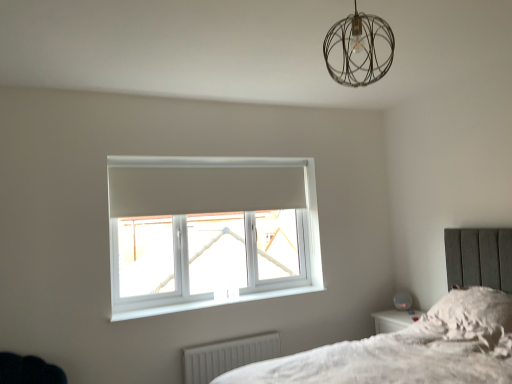
Where is `empty space that is ontop of white plastic window sill at lower center (from a real-world perspective)`? empty space that is ontop of white plastic window sill at lower center (from a real-world perspective) is located at coordinates (227, 296).